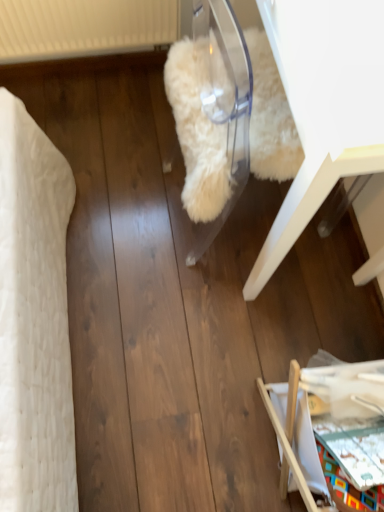
Question: Do you think white fluffy rug at center, placed as the second furniture when sorted from bottom to top, is within wooden folding chair at lower right, which appears as the second furniture when viewed from the top, or outside of it?

Choices:
 (A) outside
 (B) inside

Answer: (A)

Question: Would you say white fluffy rug at center, placed as the second furniture when sorted from bottom to top, is to the left or to the right of wooden folding chair at lower right, marked as the first furniture in a bottom-to-top arrangement, in the picture?

Choices:
 (A) left
 (B) right

Answer: (A)

Question: In terms of width, does white fluffy rug at center, acting as the first furniture starting from the top, look wider or thinner when compared to wooden folding chair at lower right, which appears as the second furniture when viewed from the top?

Choices:
 (A) wide
 (B) thin

Answer: (B)

Question: Based on their sizes in the image, would you say wooden folding chair at lower right, which appears as the second furniture when viewed from the top, is bigger or smaller than white fluffy rug at center, placed as the second furniture when sorted from bottom to top?

Choices:
 (A) big
 (B) small

Answer: (B)

Question: Choose the correct answer: Is wooden folding chair at lower right, marked as the first furniture in a bottom-to-top arrangement, inside white fluffy rug at center, placed as the second furniture when sorted from bottom to top, or outside it?

Choices:
 (A) outside
 (B) inside

Answer: (A)

Question: From a real-world perspective, is wooden folding chair at lower right, which appears as the second furniture when viewed from the top, positioned above or below white fluffy rug at center, acting as the first furniture starting from the top?

Choices:
 (A) above
 (B) below

Answer: (B)

Question: Would you say wooden folding chair at lower right, which appears as the second furniture when viewed from the top, is to the left or to the right of white fluffy rug at center, acting as the first furniture starting from the top, in the picture?

Choices:
 (A) left
 (B) right

Answer: (B)